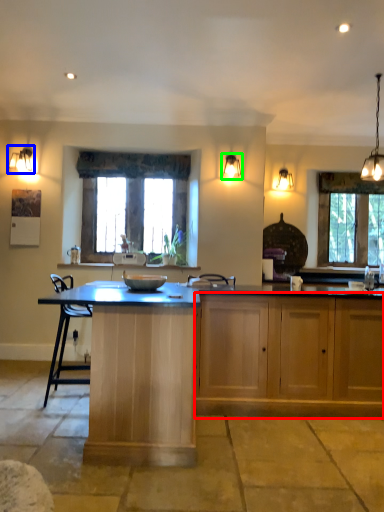
Question: Which object is the closest to the cabinetry (highlighted by a red box)? Choose among these: lamp (highlighted by a blue box) or lamp (highlighted by a green box).

Choices:
 (A) lamp
 (B) lamp

Answer: (B)